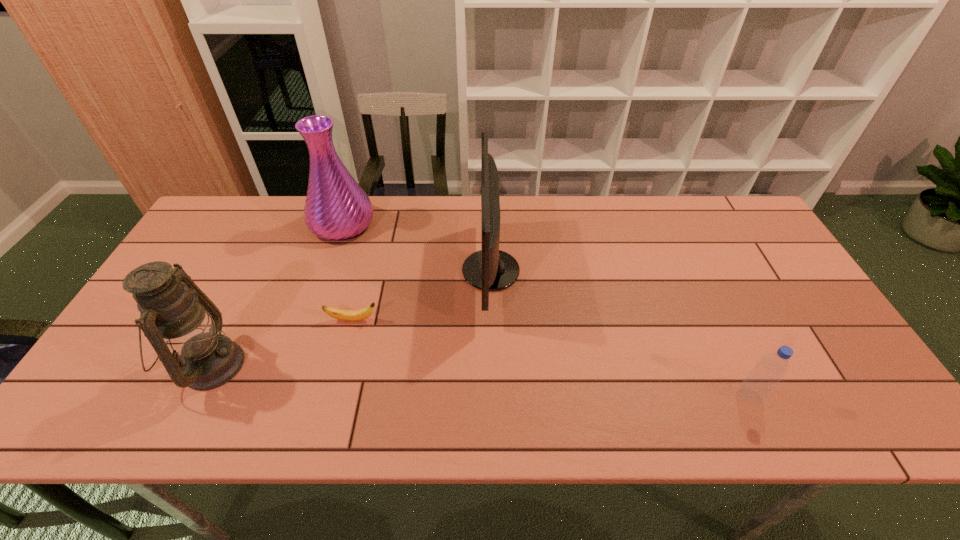
Find the location of a particular element. vacant space at the near edge of the desktop is located at coordinates pos(503,413).

In the image, there is a desktop. At what (x,y) coordinates should I click in order to perform the action: click on free space at the left edge. Please return your answer as a coordinate pair (x, y). The height and width of the screenshot is (540, 960). Looking at the image, I should click on (194, 244).

Find the location of a particular element. vacant region at the right edge of the desktop is located at coordinates (839, 360).

This screenshot has height=540, width=960. Find the location of `free space at the far left corner`. free space at the far left corner is located at coordinates (252, 207).

Where is `vacant area at the far right corner of the desktop`? This screenshot has height=540, width=960. vacant area at the far right corner of the desktop is located at coordinates (715, 229).

What are the coordinates of `vacant area that lies between the fourth tallest object and the fourth object from left to right` in the screenshot? It's located at (620, 333).

Where is `vacant space in between the shortest object and the vase`? The width and height of the screenshot is (960, 540). vacant space in between the shortest object and the vase is located at coordinates tap(348, 272).

Locate an element on the screen. This screenshot has width=960, height=540. vacant space in between the oil lamp and the banana is located at coordinates (282, 343).

In order to click on free space between the rightmost object and the banana in this screenshot , I will do `click(551, 358)`.

Image resolution: width=960 pixels, height=540 pixels. Find the location of `vacant space that is in between the vase and the shortest object`. vacant space that is in between the vase and the shortest object is located at coordinates (348, 272).